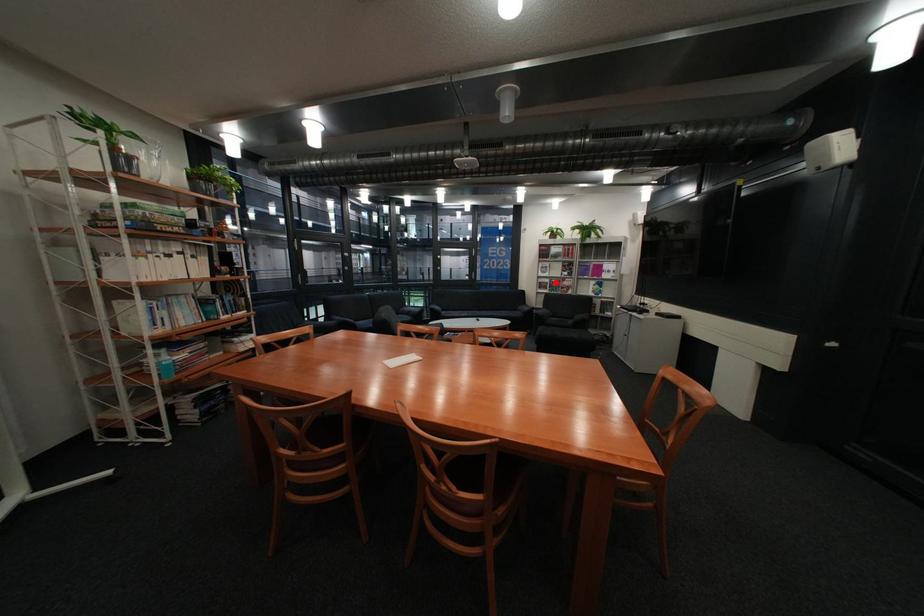
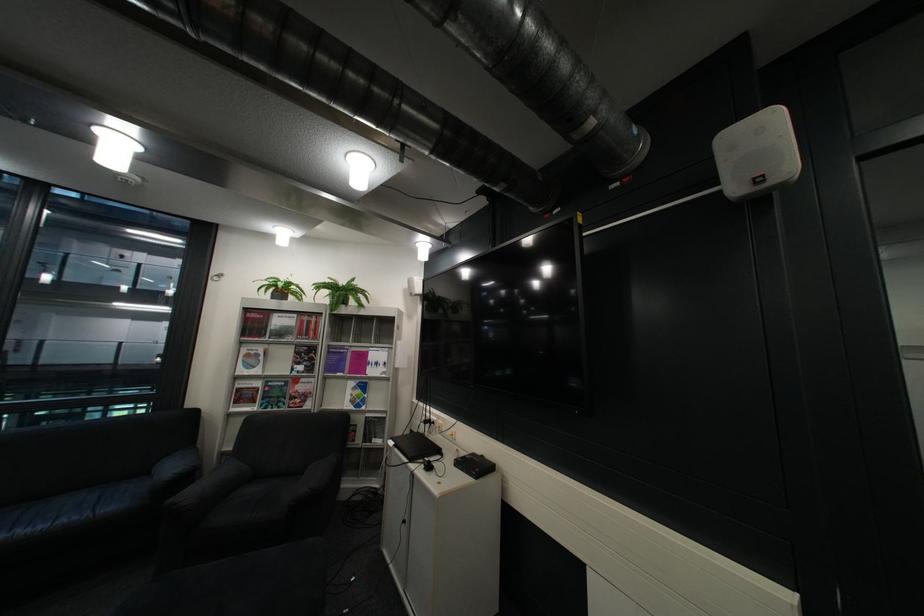
Locate, in the second image, the point that corresponds to the highlighted location in the first image.

(254, 390)